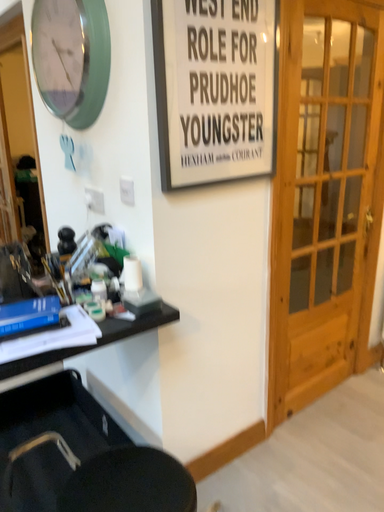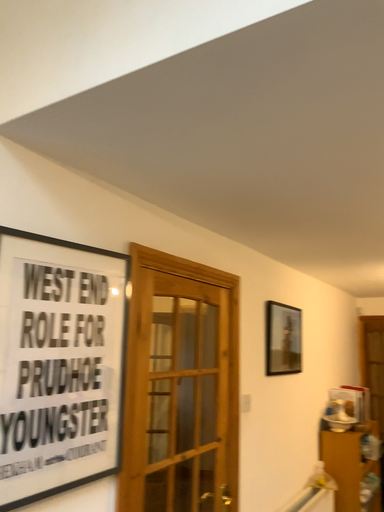
Question: How did the camera likely rotate when shooting the video?

Choices:
 (A) rotated downward
 (B) rotated upward

Answer: (B)